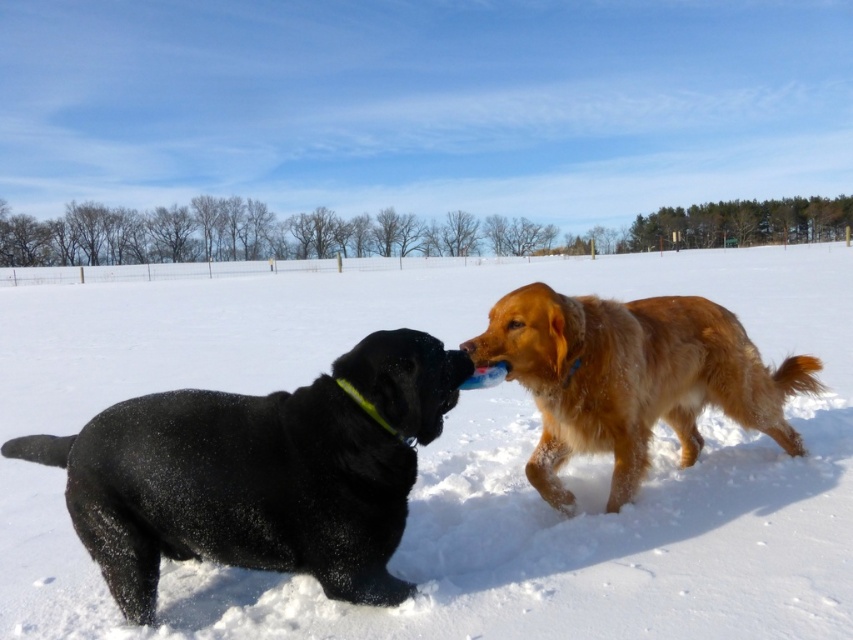
You are standing at the point marked as point (456, 460) in the image. What is the color of the ground beneath your feet?

The point (456, 460) is on white fluffy snow at center, so the ground beneath your feet is white.